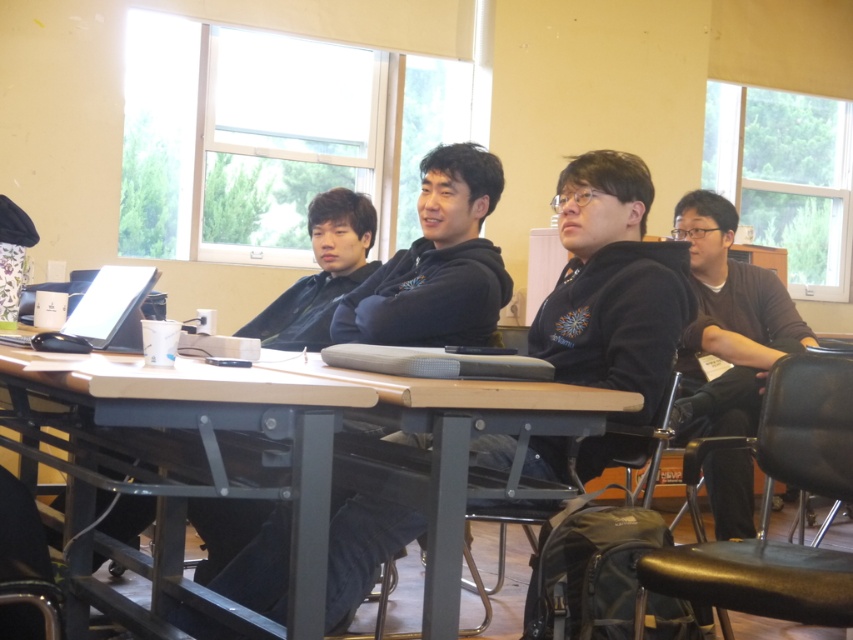
Question: Is wooden table at center to the left of dark brown sweater at right from the viewer's perspective?

Choices:
 (A) yes
 (B) no

Answer: (A)

Question: Which point appears closest to the camera in this image?

Choices:
 (A) (699, 408)
 (B) (61, 497)

Answer: (A)

Question: Which object is farther from the camera taking this photo?

Choices:
 (A) dark brown sweater at right
 (B) wooden table at center

Answer: (A)

Question: Does black fleece hoodie at center have a larger size compared to matte black laptop at left?

Choices:
 (A) yes
 (B) no

Answer: (A)

Question: Observing the image, what is the correct spatial positioning of black fleece hoodie at center in reference to dark brown sweater at right?

Choices:
 (A) right
 (B) left

Answer: (B)

Question: Among these points, which one is farthest from the camera?

Choices:
 (A) (235, 333)
 (B) (120, 340)
 (C) (697, 326)

Answer: (A)